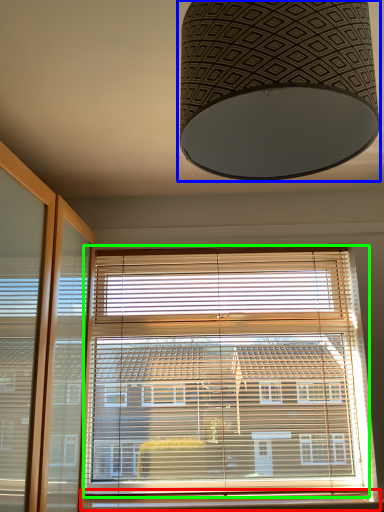
Question: Based on their relative distances, which object is farther from window sill (highlighted by a red box)? Choose from lamp (highlighted by a blue box) and window blind (highlighted by a green box).

Choices:
 (A) lamp
 (B) window blind

Answer: (A)